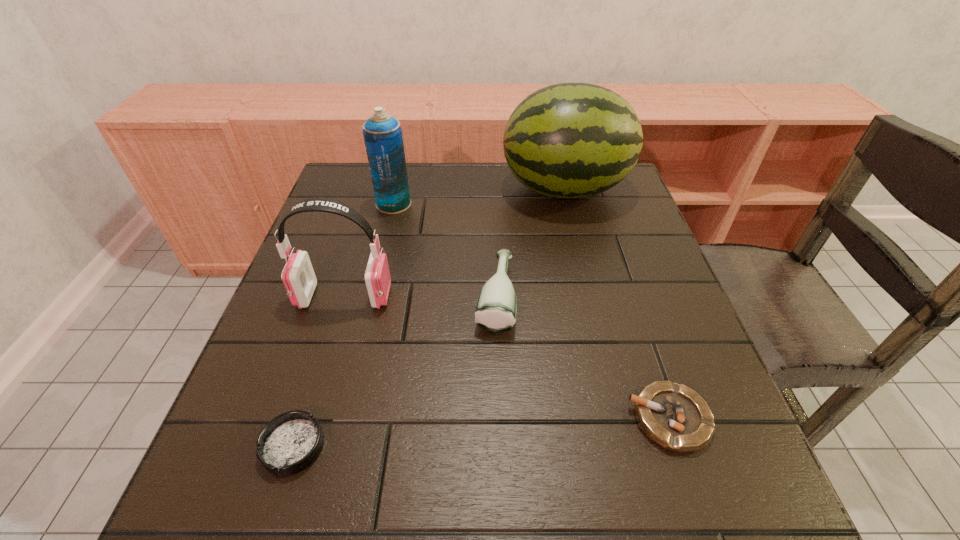
Image resolution: width=960 pixels, height=540 pixels. Find the location of `free space located at the stem end of the watermelon`. free space located at the stem end of the watermelon is located at coordinates (412, 190).

The image size is (960, 540). I want to click on free space located on the right of the aerosol can, so click(442, 204).

Identify the location of free space located on the outer surface of the earphone. The height and width of the screenshot is (540, 960). (522, 296).

The height and width of the screenshot is (540, 960). Identify the location of free spot located on the right of the fourth tallest object. (600, 297).

Locate an element on the screen. free space located on the back of the right ashtray is located at coordinates (628, 295).

Identify the location of free region located on the right of the left ashtray. (374, 446).

The width and height of the screenshot is (960, 540). I want to click on watermelon that is at the far edge, so click(x=572, y=140).

Find the location of a particular element. The image size is (960, 540). aerosol can that is at the far edge is located at coordinates (383, 138).

The height and width of the screenshot is (540, 960). What are the coordinates of `object that is positioned at the near edge` in the screenshot? It's located at (289, 443).

This screenshot has width=960, height=540. In order to click on aerosol can that is positioned at the left edge in this screenshot , I will do `click(383, 138)`.